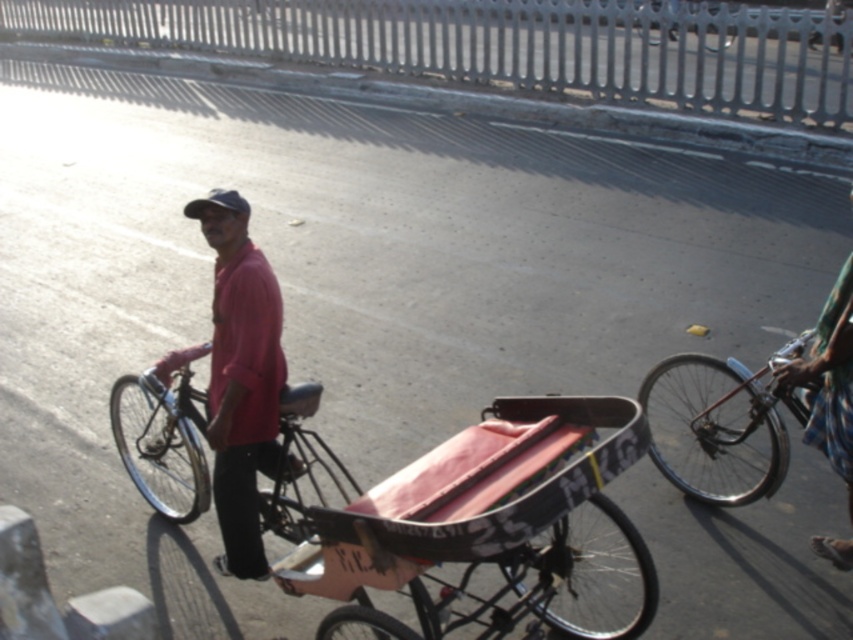
Who is positioned more to the left, shiny black bicycle at center or green plaid shirt at right?

shiny black bicycle at center is more to the left.

What do you see at coordinates (164, 435) in the screenshot? The image size is (853, 640). I see `shiny black bicycle at center` at bounding box center [164, 435].

Is point (300, 452) closer to camera compared to point (793, 378)?

Yes, point (300, 452) is in front of point (793, 378).

At what (x,y) coordinates should I click in order to perform the action: click on shiny black bicycle at center. Please return your answer as a coordinate pair (x, y). Looking at the image, I should click on click(164, 435).

Who is positioned more to the right, pink matte shirt at center or green plaid shirt at right?

green plaid shirt at right is more to the right.

Describe the element at coordinates (241, 378) in the screenshot. I see `pink matte shirt at center` at that location.

Is point (231, 541) farther from camera compared to point (828, 397)?

That is True.

Where is `pink matte shirt at center`? The image size is (853, 640). pink matte shirt at center is located at coordinates (241, 378).

Is the position of green plaid shirt at right more distant than that of metallic silver bicycle at center?

No, green plaid shirt at right is closer to the viewer.

Who is shorter, green plaid shirt at right or metallic silver bicycle at center?

green plaid shirt at right is shorter.

Which is behind, point (846, 397) or point (712, 24)?

Point (712, 24)

Find the location of a particular element. The image size is (853, 640). green plaid shirt at right is located at coordinates (830, 380).